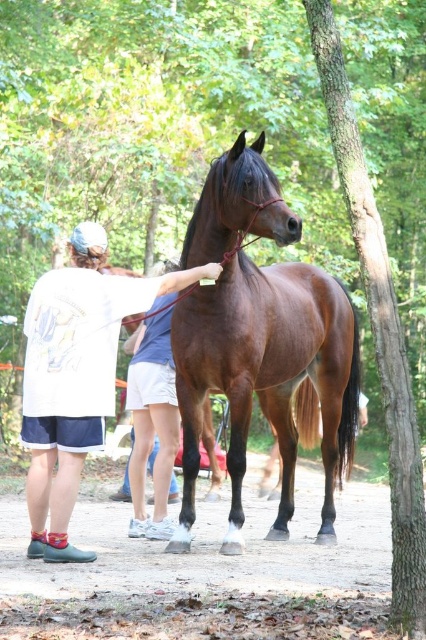
You are a horse trainer who needs to secure the brown glossy horse at center to a post located behind the white cotton shirt at left. The rope you have is 1 meter long. Will the rope be sufficient to tie the horse to the post?

The brown glossy horse at center and the white cotton shirt at left are 1.03 meters apart. Since the rope is only 1 meter long, it is 3 centimeters too short to reach the post behind the white cotton shirt at left.

You are standing in a wooded area and see two points marked in the image. Which point is closer to you, point (247, 419) or point (85, 406)?

Point (85, 406) is closer to you because it is less further than point (247, 419) according to the description.